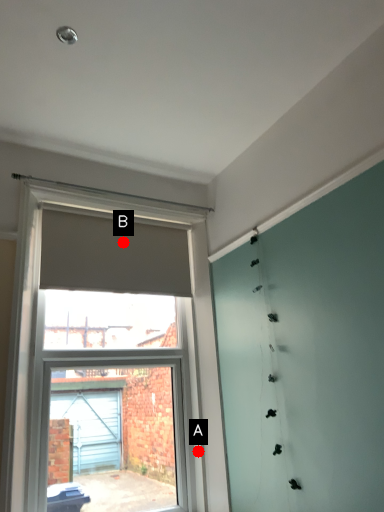
Question: Two points are circled on the image, labeled by A and B beside each circle. Which point is farther to the camera?

Choices:
 (A) A is further
 (B) B is further

Answer: (B)